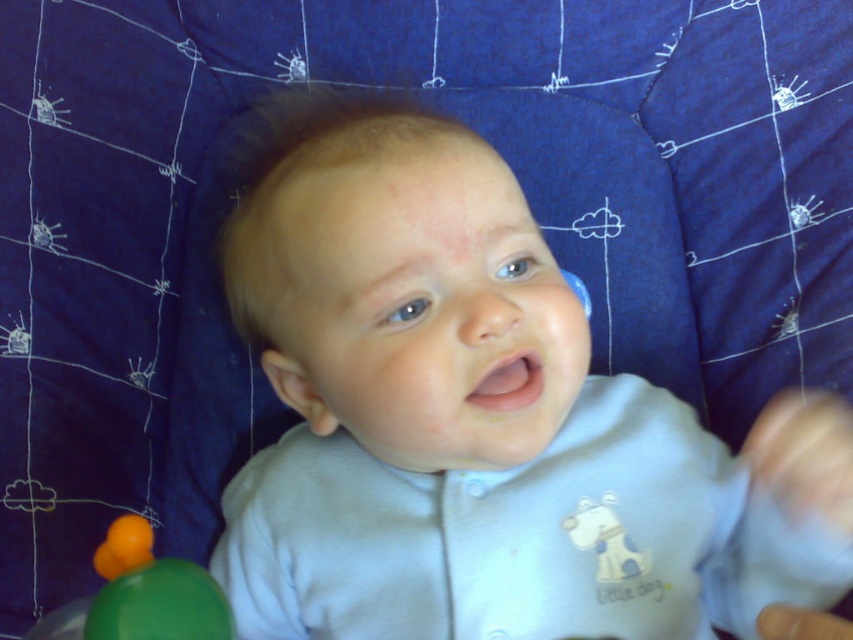
You are a photographer setting up for a baby photoshoot. The baby is lying on the light blue fabric baby at center and there is a green rubber ball at lower left. To ensure the ball is in focus while keeping the baby sharp, which object should you adjust the camera focus on first?

The light blue fabric baby at center is further to the viewer than the green rubber ball at lower left. To keep both in focus, adjust the camera focus on the green rubber ball at lower left first since it is closer to the camera, ensuring depth of field captures both the nearer ball and the farther baby.

You are a parent trying to play with your baby. You see the light blue fabric baby at center and the green rubber ball at lower left. Which object is higher up in the image?

The light blue fabric baby at center is located above the green rubber ball at lower left, so it is higher up in the image.